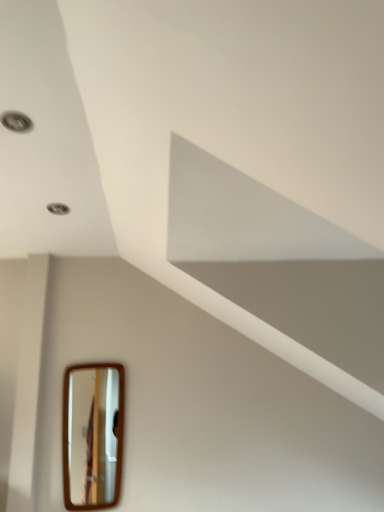
Question: Does wooden-framed mirror at lower left lie in front of matte silver droplight at upper left?

Choices:
 (A) no
 (B) yes

Answer: (A)

Question: From a real-world perspective, is wooden-framed mirror at lower left beneath matte silver droplight at upper left?

Choices:
 (A) no
 (B) yes

Answer: (B)

Question: Would you say wooden-framed mirror at lower left contains matte silver droplight at upper left?

Choices:
 (A) yes
 (B) no

Answer: (B)

Question: Is wooden-framed mirror at lower left not near matte silver droplight at upper left?

Choices:
 (A) no
 (B) yes

Answer: (B)

Question: Is wooden-framed mirror at lower left shorter than matte silver droplight at upper left?

Choices:
 (A) no
 (B) yes

Answer: (A)

Question: Considering the relative positions of wooden-framed mirror at lower left and matte silver droplight at upper left in the image provided, is wooden-framed mirror at lower left to the right of matte silver droplight at upper left from the viewer's perspective?

Choices:
 (A) no
 (B) yes

Answer: (B)

Question: Considering the relative positions of matte silver droplight at upper left and wooden-framed mirror at lower left in the image provided, is matte silver droplight at upper left to the left of wooden-framed mirror at lower left from the viewer's perspective?

Choices:
 (A) no
 (B) yes

Answer: (B)

Question: Considering the relative sizes of matte silver droplight at upper left and wooden-framed mirror at lower left in the image provided, is matte silver droplight at upper left smaller than wooden-framed mirror at lower left?

Choices:
 (A) no
 (B) yes

Answer: (B)

Question: Would you say matte silver droplight at upper left is a long distance from wooden-framed mirror at lower left?

Choices:
 (A) no
 (B) yes

Answer: (B)

Question: Does matte silver droplight at upper left touch wooden-framed mirror at lower left?

Choices:
 (A) no
 (B) yes

Answer: (A)

Question: From a real-world perspective, is matte silver droplight at upper left under wooden-framed mirror at lower left?

Choices:
 (A) no
 (B) yes

Answer: (A)

Question: Is matte silver droplight at upper left wider than wooden-framed mirror at lower left?

Choices:
 (A) yes
 (B) no

Answer: (A)

Question: Looking at their shapes, would you say matte silver droplight at upper left is wider or thinner than wooden-framed mirror at lower left?

Choices:
 (A) wide
 (B) thin

Answer: (A)